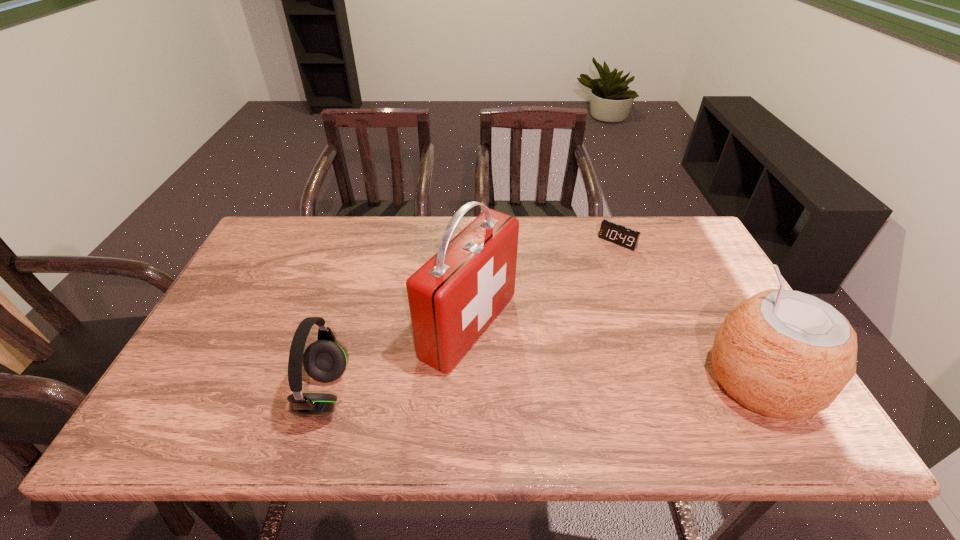
Locate an element on the screen. free spot between the third tallest object and the second object from left to right is located at coordinates (396, 360).

Find the location of a particular element. The width and height of the screenshot is (960, 540). vacant point located between the first-aid kit and the second shortest object is located at coordinates (396, 360).

This screenshot has height=540, width=960. Identify the location of blank region between the rightmost object and the third tallest object. (542, 388).

This screenshot has height=540, width=960. I want to click on vacant point located between the second object from right to left and the first-aid kit, so click(543, 284).

The height and width of the screenshot is (540, 960). I want to click on vacant space that is in between the first-aid kit and the leftmost object, so click(396, 360).

Identify the location of vacant area that lies between the shortest object and the tallest object. (543, 284).

The width and height of the screenshot is (960, 540). I want to click on empty space between the first-aid kit and the rightmost object, so click(614, 354).

At what (x,y) coordinates should I click in order to perform the action: click on object identified as the closest to the third object from right to left. Please return your answer as a coordinate pair (x, y). The image size is (960, 540). Looking at the image, I should click on [x=325, y=360].

Choose which object is the nearest neighbor to the farthest object. Please provide its 2D coordinates. Your answer should be formatted as a tuple, i.e. [(x, y)], where the tuple contains the x and y coordinates of a point satisfying the conditions above.

[(453, 297)]

Where is `vacant point that satisfies the following two spatial constraints: 1. on the front side of the farthest object; 2. on the right side of the rightmost object`? vacant point that satisfies the following two spatial constraints: 1. on the front side of the farthest object; 2. on the right side of the rightmost object is located at coordinates (671, 382).